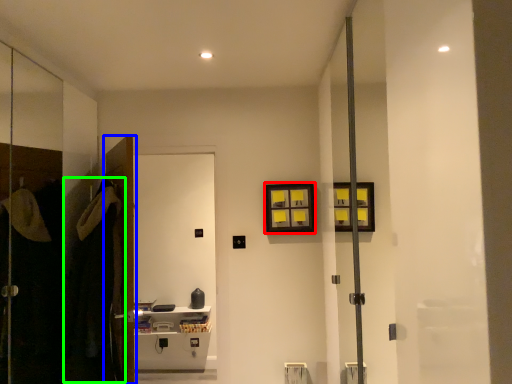
Question: Which is nearer to the picture frame (highlighted by a red box)? door (highlighted by a blue box) or robe (highlighted by a green box).

Choices:
 (A) door
 (B) robe

Answer: (A)